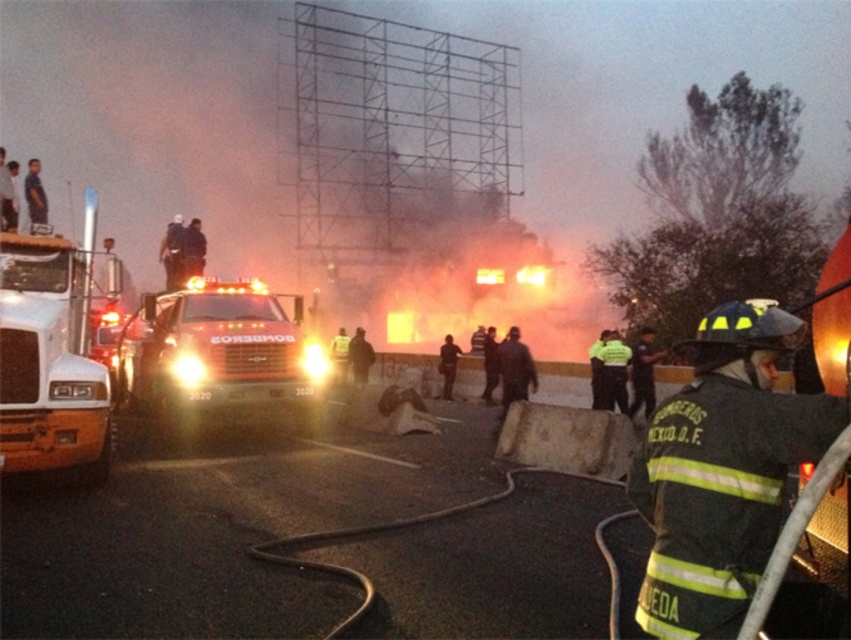
You are a firefighter who just arrived at the scene. You need to quickly identify your team member and the fire truck. Based on the image, which object is smaller in size between the dark green reflective uniform at center and the white glossy fire truck at left?

The dark green reflective uniform at center is smaller in size compared to the white glossy fire truck at left.